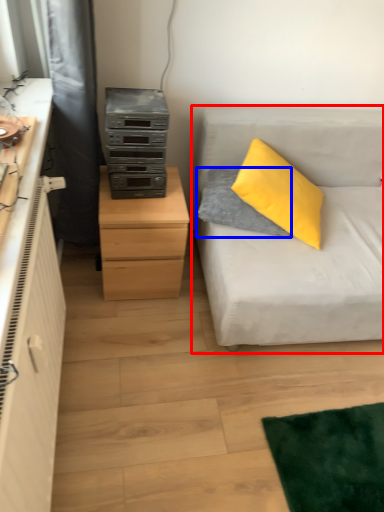
Question: Which point is further to the camera, studio couch (highlighted by a red box) or pillow (highlighted by a blue box)?

Choices:
 (A) studio couch
 (B) pillow

Answer: (B)